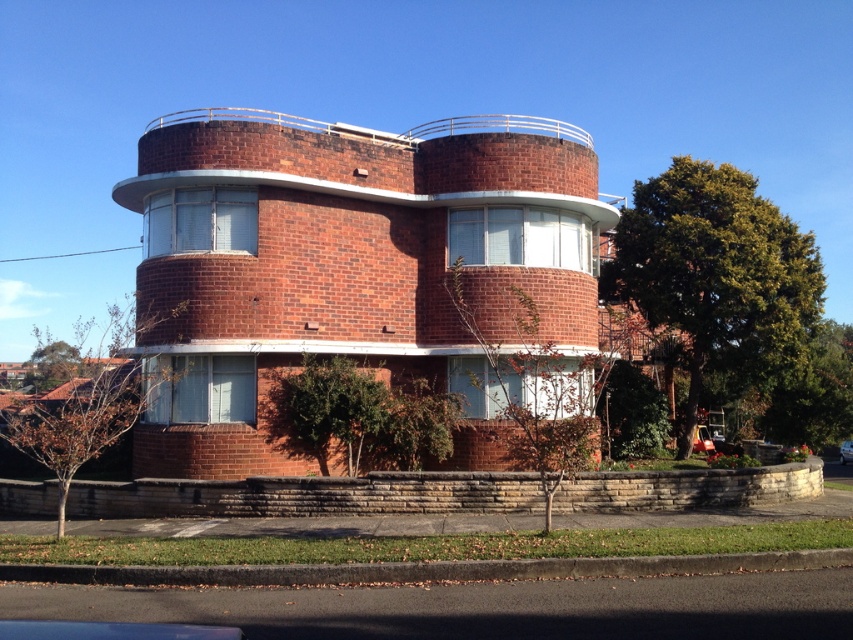
Based on the photo, you are a pedestrian standing at the entrance of the brick building. You see two cars in front of you, a metallic silver car at lower right and a silver metallic car at center. Which car is closer to you?

The metallic silver car at lower right is closer to you because it is positioned over the silver metallic car at center, indicating it is in front.

You are standing at the entrance of the brick building and want to take a photo of the point at coordinate point (708, 449). Your camera has a maximum focus range of 85 feet. Will the camera be able to focus on that point?

The distance of point (708, 449) from the camera is 86.19 feet, which exceeds the camera maximum focus range of 85 feet. The camera will not be able to focus on that point.

You are standing at the entrance of the brick building and want to park your car. There are two cars in the area, a metallic silver car at lower right and a silver metallic car at center. Which car is farther from the entrance?

The metallic silver car at lower right is farther from the entrance than the silver metallic car at center because it is 56.22 feet away from it.